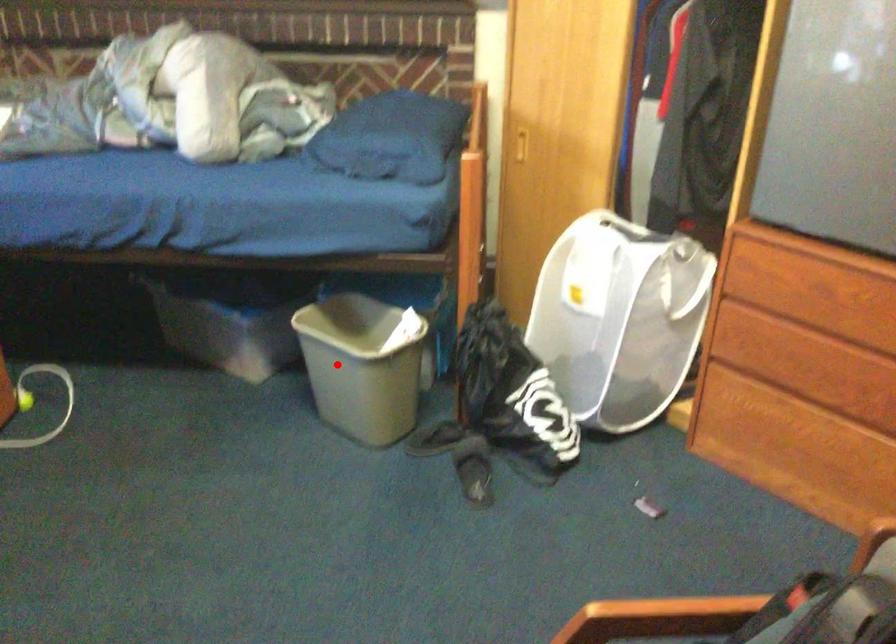
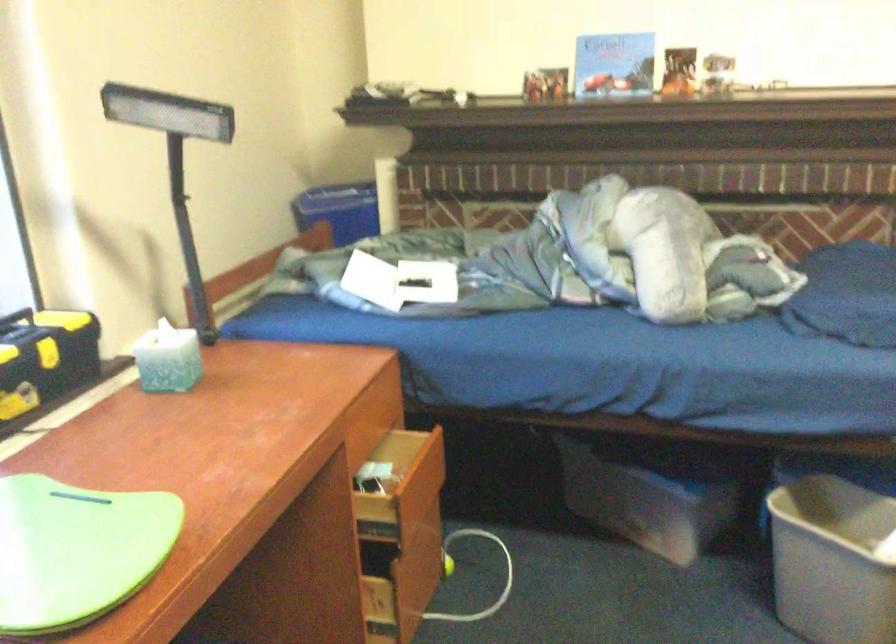
Question: A red point is marked in image1. In image2, is the corresponding 3D point closer to the camera or farther? Reply with the corresponding letter.

Choices:
 (A) The corresponding 3D point is closer.
 (B) The corresponding 3D point is farther.

Answer: (A)